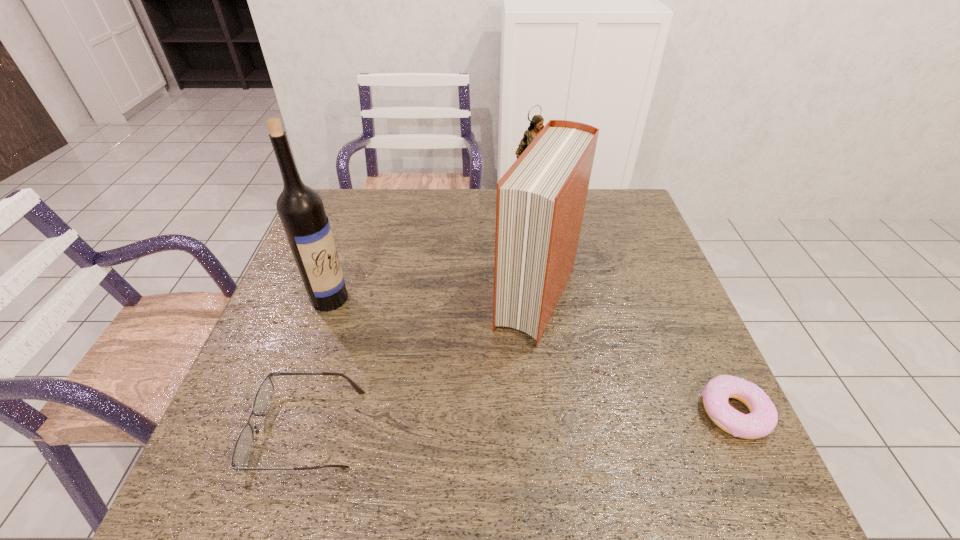
Find the location of a particular element. Image resolution: width=960 pixels, height=540 pixels. spectacles present at the left edge is located at coordinates (244, 441).

The height and width of the screenshot is (540, 960). I want to click on wine bottle that is at the left edge, so click(x=300, y=208).

Image resolution: width=960 pixels, height=540 pixels. What are the coordinates of `object situated at the right edge` in the screenshot? It's located at (763, 417).

Where is `object located at the near left corner`? This screenshot has width=960, height=540. object located at the near left corner is located at coordinates (244, 441).

Locate an element on the screen. object at the near right corner is located at coordinates (763, 417).

Locate an element on the screen. vacant space at the far edge of the desktop is located at coordinates [x=587, y=218].

Where is `vacant space at the near edge`? vacant space at the near edge is located at coordinates (423, 406).

You are a GUI agent. You are given a task and a screenshot of the screen. Output one action in this format:
    pyautogui.click(x=<x>, y=<y>)
    Task: Click on the vacant region at the left edge of the desktop
    The image size is (960, 540).
    Given the screenshot: What is the action you would take?
    pyautogui.click(x=292, y=375)

At what (x,y) coordinates should I click in order to perform the action: click on free space at the right edge of the desktop. Please return your answer as a coordinate pair (x, y). Looking at the image, I should click on (677, 294).

In the image, there is a desktop. Where is `free space at the far left corner`? free space at the far left corner is located at coordinates (355, 211).